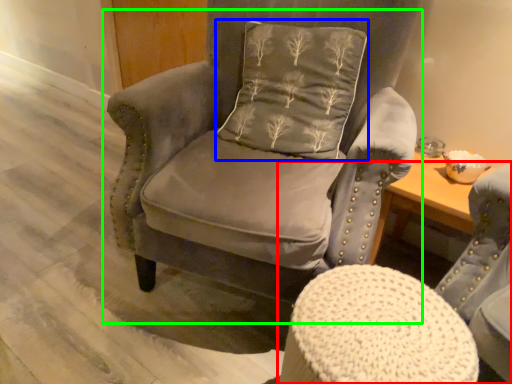
Question: Estimate the real-world distances between objects in this image. Which object is closer to chair (highlighted by a red box), pillow (highlighted by a blue box) or chair (highlighted by a green box)?

Choices:
 (A) pillow
 (B) chair

Answer: (B)